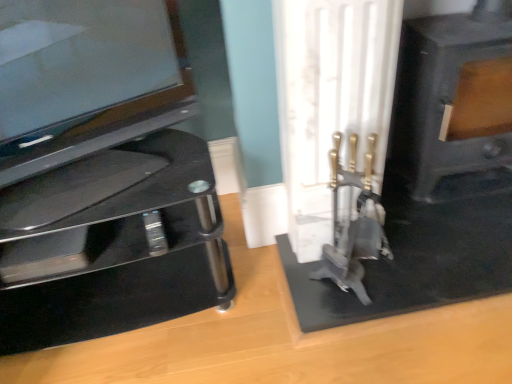
Question: Is glossy black tv at left not within black matte fireplace at right?

Choices:
 (A) yes
 (B) no

Answer: (A)

Question: Does glossy black tv at left have a smaller size compared to black matte fireplace at right?

Choices:
 (A) no
 (B) yes

Answer: (B)

Question: From a real-world perspective, is glossy black tv at left over black matte fireplace at right?

Choices:
 (A) no
 (B) yes

Answer: (B)

Question: Does glossy black tv at left have a greater height compared to black matte fireplace at right?

Choices:
 (A) yes
 (B) no

Answer: (B)

Question: Considering the relative sizes of glossy black tv at left and black matte fireplace at right in the image provided, is glossy black tv at left thinner than black matte fireplace at right?

Choices:
 (A) no
 (B) yes

Answer: (B)

Question: Is black matte fireplace at right inside the boundaries of glossy black tv at left, or outside?

Choices:
 (A) inside
 (B) outside

Answer: (B)

Question: From their relative heights in the image, would you say black matte fireplace at right is taller or shorter than glossy black tv at left?

Choices:
 (A) tall
 (B) short

Answer: (A)

Question: From a real-world perspective, is black matte fireplace at right physically located above or below glossy black tv at left?

Choices:
 (A) below
 (B) above

Answer: (A)

Question: From the image's perspective, is black matte fireplace at right located above or below glossy black tv at left?

Choices:
 (A) above
 (B) below

Answer: (A)

Question: Based on their sizes in the image, would you say black glass tv stand at left is bigger or smaller than black matte fireplace at right?

Choices:
 (A) big
 (B) small

Answer: (A)

Question: Is black glass tv stand at left spatially inside black matte fireplace at right, or outside of it?

Choices:
 (A) outside
 (B) inside

Answer: (A)

Question: Considering their positions, is black glass tv stand at left located in front of or behind black matte fireplace at right?

Choices:
 (A) front
 (B) behind

Answer: (A)

Question: From a real-world perspective, is black glass tv stand at left above or below black matte fireplace at right?

Choices:
 (A) above
 (B) below

Answer: (B)

Question: Is black matte fireplace at right in front of or behind black glass tv stand at left in the image?

Choices:
 (A) behind
 (B) front

Answer: (A)

Question: From the image's perspective, is black matte fireplace at right above or below black glass tv stand at left?

Choices:
 (A) above
 (B) below

Answer: (A)